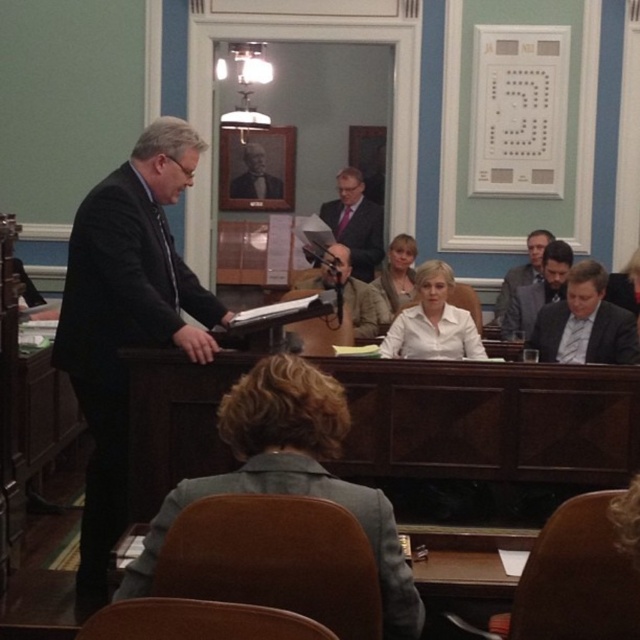
Is black matte suit at left wider than light brown hair at center?

Yes.

Locate an element on the screen. Image resolution: width=640 pixels, height=640 pixels. black matte suit at left is located at coordinates (116, 336).

This screenshot has height=640, width=640. What do you see at coordinates (116, 336) in the screenshot? I see `black matte suit at left` at bounding box center [116, 336].

Identify the location of black matte suit at left. (116, 336).

Is white matte shirt at center positioned before light beige jacket at center?

That is True.

What do you see at coordinates (433, 321) in the screenshot? I see `white matte shirt at center` at bounding box center [433, 321].

The height and width of the screenshot is (640, 640). In order to click on white matte shirt at center in this screenshot , I will do `click(433, 321)`.

Does matte black suit at center appear under dark gray fabric business suit at right?

Correct, matte black suit at center is located below dark gray fabric business suit at right.

What do you see at coordinates (528, 307) in the screenshot? This screenshot has width=640, height=640. I see `matte black suit at center` at bounding box center [528, 307].

The width and height of the screenshot is (640, 640). I want to click on matte black suit at center, so click(528, 307).